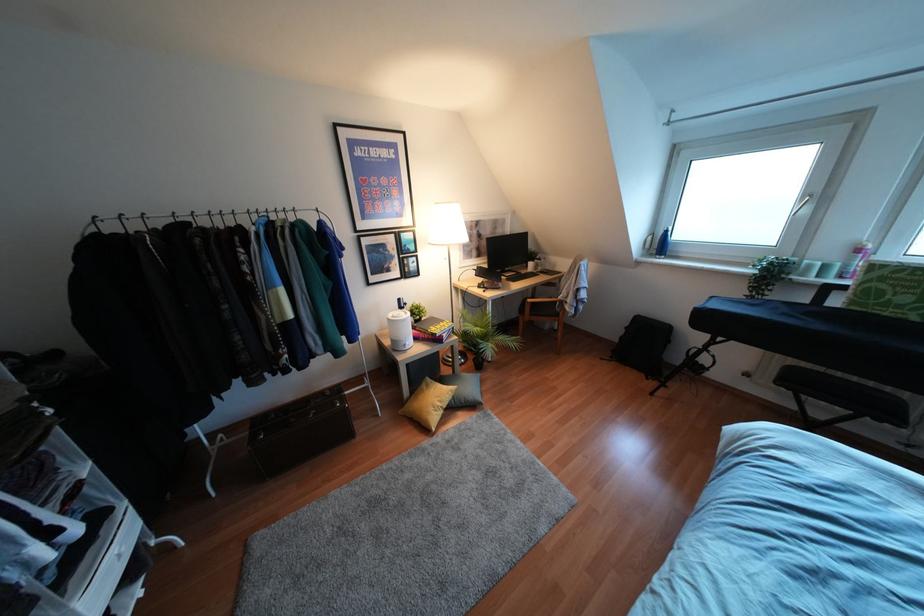
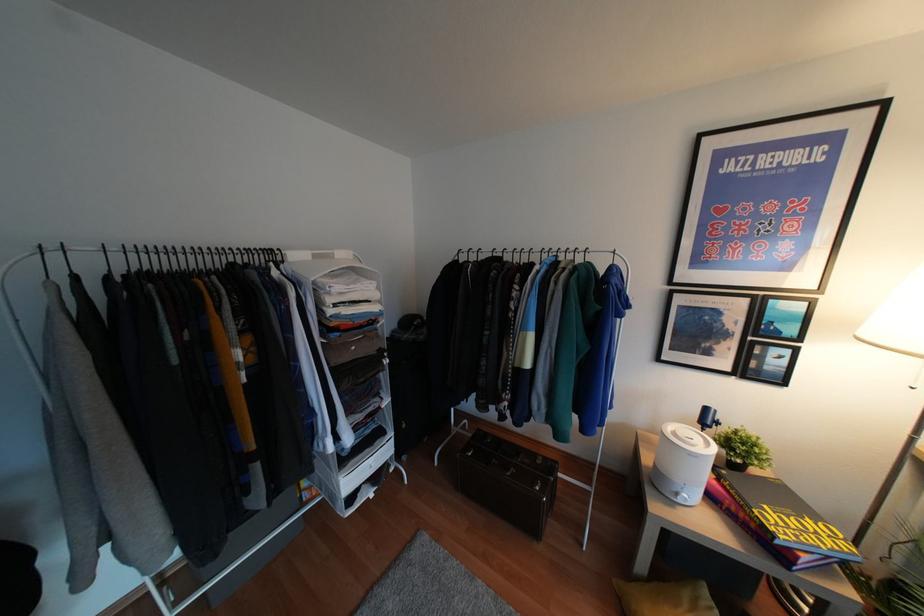
Question: The camera is either moving clockwise (left) or counter-clockwise (right) around the object. The first image is from the beginning of the video and the second image is from the end. Is the camera moving left or right when shooting the video?

Choices:
 (A) Left
 (B) Right

Answer: (B)